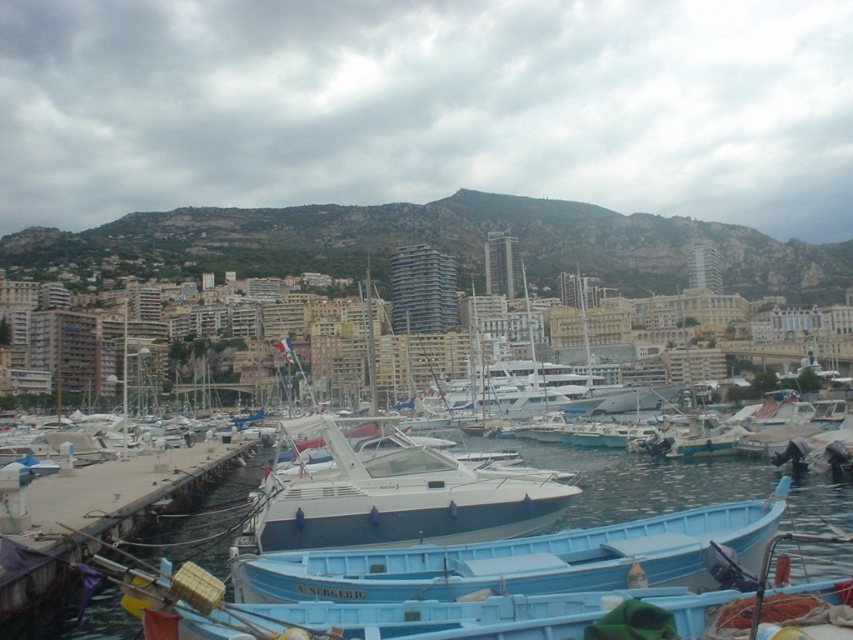
Who is more distant from viewer, (740, 497) or (270, 477)?

Point (740, 497)

Can you confirm if blue water at center is smaller than white glossy boat at center?

No, blue water at center is not smaller than white glossy boat at center.

Is point (614, 515) more distant than point (480, 531)?

That is True.

At what (x,y) coordinates should I click in order to perform the action: click on blue water at center. Please return your answer as a coordinate pair (x, y). This screenshot has height=640, width=853. Looking at the image, I should click on (641, 481).

Can you confirm if white glossy boat at center is wider than concrete dock at lower left?

Correct, the width of white glossy boat at center exceeds that of concrete dock at lower left.

Which is more to the right, white glossy boat at center or concrete dock at lower left?

white glossy boat at center is more to the right.

Identify the location of white glossy boat at center. The image size is (853, 640). (395, 499).

Is blue water at center behind concrete dock at lower left?

No, it is not.

Is blue water at center bigger than concrete dock at lower left?

Indeed, blue water at center has a larger size compared to concrete dock at lower left.

What do you see at coordinates (641, 481) in the screenshot? The width and height of the screenshot is (853, 640). I see `blue water at center` at bounding box center [641, 481].

You are a GUI agent. You are given a task and a screenshot of the screen. Output one action in this format:
    pyautogui.click(x=<x>, y=<y>)
    Task: Click on the blue water at center
    The width and height of the screenshot is (853, 640).
    Given the screenshot: What is the action you would take?
    pyautogui.click(x=641, y=481)